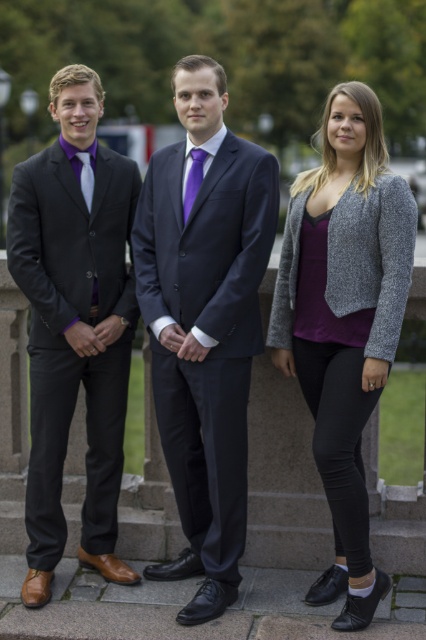
Question: Based on their relative distances, which object is farther from the purple satin tie at center?

Choices:
 (A) matte purple tie at center
 (B) knitted gray cardigan at center

Answer: (B)

Question: Is matte black suit at center to the right of matte purple tie at center from the viewer's perspective?

Choices:
 (A) no
 (B) yes

Answer: (B)

Question: Which of the following is the closest to the observer?

Choices:
 (A) (192, 96)
 (B) (368, 188)
 (C) (83, 166)
 (D) (195, 179)

Answer: (B)

Question: Is purple satin tie at center bigger than matte purple tie at center?

Choices:
 (A) no
 (B) yes

Answer: (B)

Question: Does matte black suit at center have a greater width compared to matte purple tie at center?

Choices:
 (A) yes
 (B) no

Answer: (A)

Question: Among these objects, which one is nearest to the camera?

Choices:
 (A) matte black suit at left
 (B) matte purple tie at center
 (C) purple satin tie at center

Answer: (A)